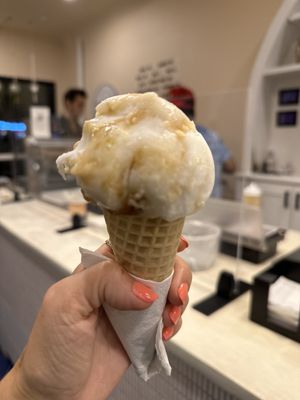
Image resolution: width=300 pixels, height=400 pixels. In order to click on 1 white counter in this screenshot , I will do tap(246, 345).